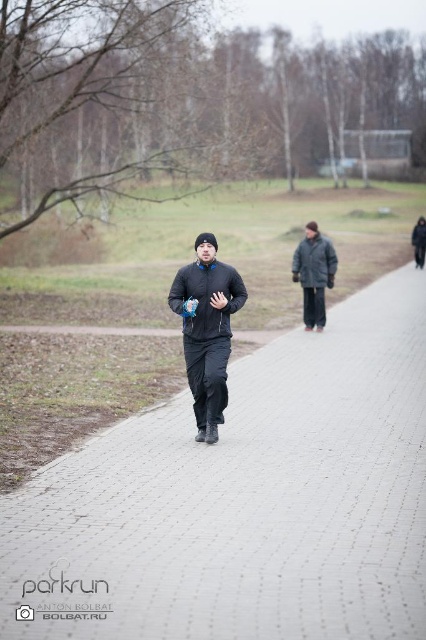
You are a photographer trying to capture the scene. You notice the gray brick pavement at center and the dark gray woolen jacket at center. Which object is positioned higher in the frame?

The gray brick pavement at center is taller than the dark gray woolen jacket at center, so the gray brick pavement at center is positioned higher in the frame.

You are standing on the gray brick pavement at center and looking down at the matte black sweatshirt at center. Which object is closer to the ground?

The matte black sweatshirt at center is closer to the ground than the gray brick pavement at center because the gray brick pavement at center is taller than the matte black sweatshirt at center.